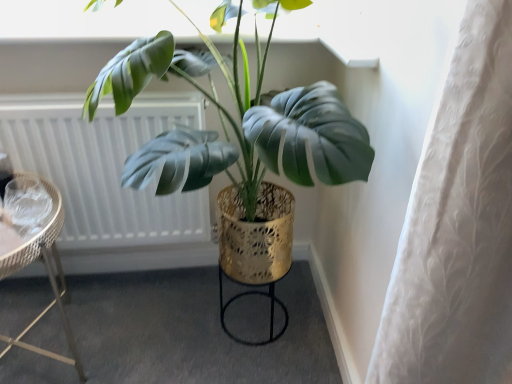
Question: Is shiny gold pot at center in front of or behind gold textured stool at center in the image?

Choices:
 (A) front
 (B) behind

Answer: (A)

Question: In terms of height, does shiny gold pot at center look taller or shorter compared to gold textured stool at center?

Choices:
 (A) tall
 (B) short

Answer: (A)

Question: Considering the real-world distances, which object is farthest from the shiny gold pot at center?

Choices:
 (A) metallic wicker side table at left
 (B) gold textured stool at center
 (C) white textured radiator at upper left

Answer: (B)

Question: Estimate the real-world distances between objects in this image. Which object is farther from the gold textured stool at center?

Choices:
 (A) white textured radiator at upper left
 (B) metallic wicker side table at left
 (C) shiny gold pot at center

Answer: (C)